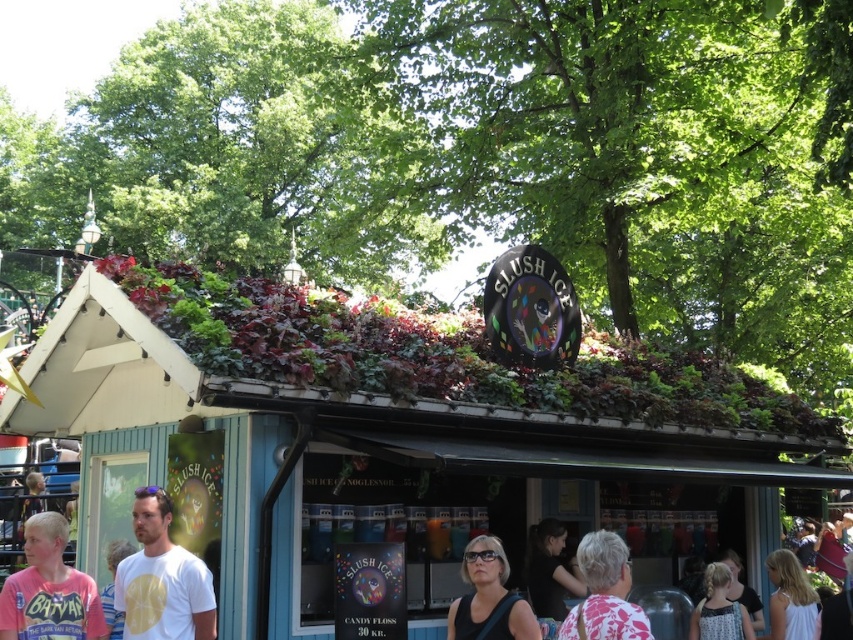
In the scene shown: You are standing at the camera position and want to reach the point marked at coordinates (635, 605). If your walking speed is 3 feet per second, how long will it take you to reach that point?

The distance between you and the point marked at coordinates (635, 605) is 43.39 feet. At a walking speed of 3 feet per second, it will take approximately 14.46 seconds to reach the point.